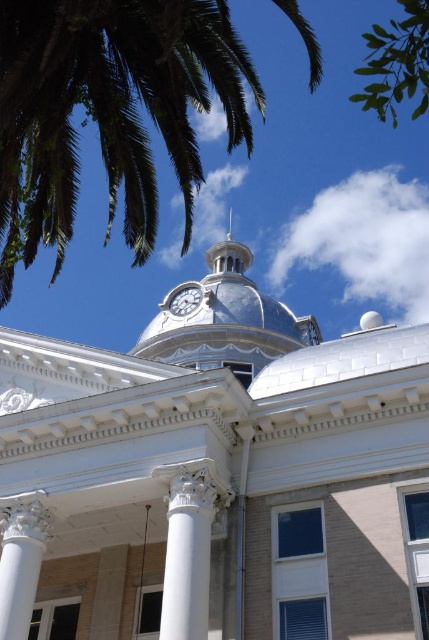
Consider the image. Is green leafy palm tree at upper left thinner than white glossy spire at upper center?

Incorrect, green leafy palm tree at upper left's width is not less than white glossy spire at upper center's.

Can you confirm if green leafy palm tree at upper left is smaller than white glossy spire at upper center?

No, green leafy palm tree at upper left is not smaller than white glossy spire at upper center.

Is point (6, 248) behind point (205, 260)?

That is False.

What are the coordinates of `green leafy palm tree at upper left` in the screenshot? It's located at (108, 112).

Does white glossy spire at upper center have a smaller size compared to white glossy clock at upper center?

No, white glossy spire at upper center is not smaller than white glossy clock at upper center.

Who is lower down, white glossy spire at upper center or white glossy clock at upper center?

white glossy clock at upper center is below.

Find the location of `white glossy spire at upper center`. white glossy spire at upper center is located at coordinates (229, 253).

Does green leafy palm tree at upper left have a larger size compared to green leafy tree at upper right?

Actually, green leafy palm tree at upper left might be smaller than green leafy tree at upper right.

Looking at this image, does green leafy palm tree at upper left appear over green leafy tree at upper right?

No.

The width and height of the screenshot is (429, 640). What do you see at coordinates (108, 112) in the screenshot? I see `green leafy palm tree at upper left` at bounding box center [108, 112].

Locate an element on the screen. The height and width of the screenshot is (640, 429). green leafy palm tree at upper left is located at coordinates (108, 112).